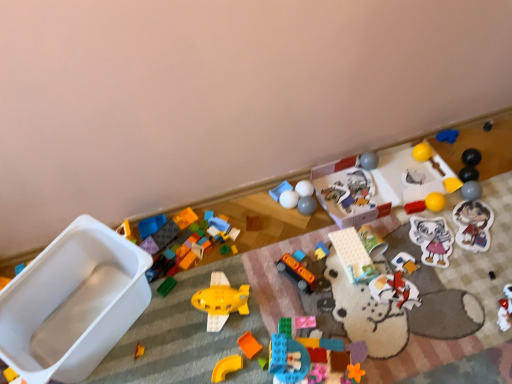
The width and height of the screenshot is (512, 384). Identify the location of free space that is to the left of matte plastic stickers at lower right, the 23th toy viewed from the left. (422, 236).